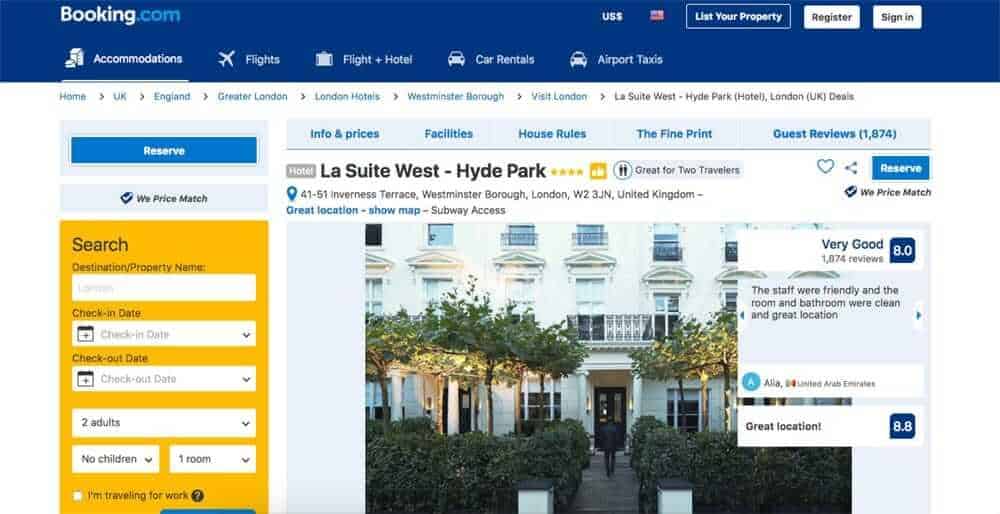
Find the location of a particular element. This screenshot has width=1000, height=514. white register box is located at coordinates (830, 7).